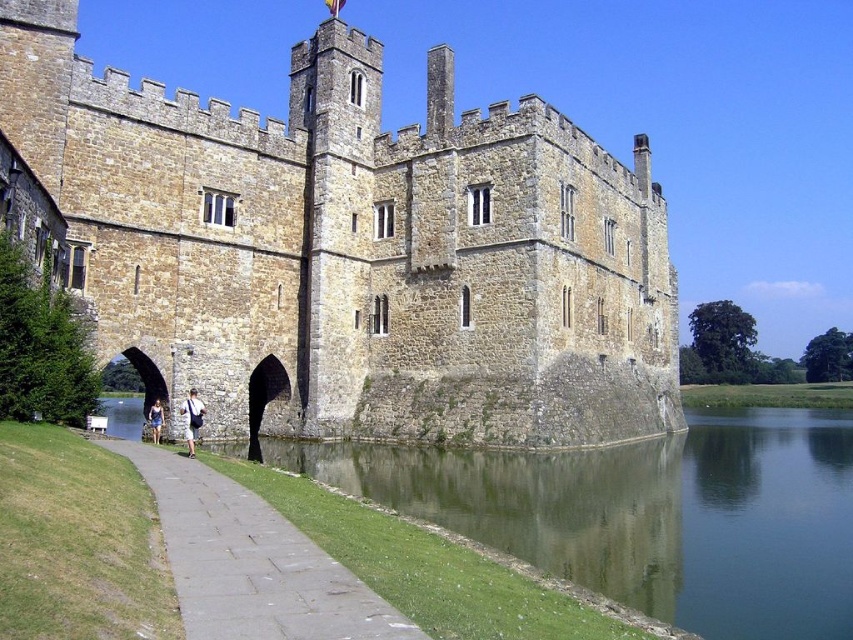
Can you confirm if brown stone castle at center is taller than gray stone path at lower left?

Correct, brown stone castle at center is much taller as gray stone path at lower left.

Does brown stone castle at center have a lesser width compared to gray stone path at lower left?

No.

Image resolution: width=853 pixels, height=640 pixels. In order to click on brown stone castle at center in this screenshot , I will do `click(354, 250)`.

The width and height of the screenshot is (853, 640). I want to click on green grassy bank at lower left, so click(x=648, y=515).

Does brown stone castle at center have a greater height compared to green grassy bank at lower left?

Indeed, brown stone castle at center has a greater height compared to green grassy bank at lower left.

Between brown stone castle at center and green grassy bank at lower left, which one is positioned lower?

Positioned lower is green grassy bank at lower left.

Locate an element on the screen. The width and height of the screenshot is (853, 640). brown stone castle at center is located at coordinates (354, 250).